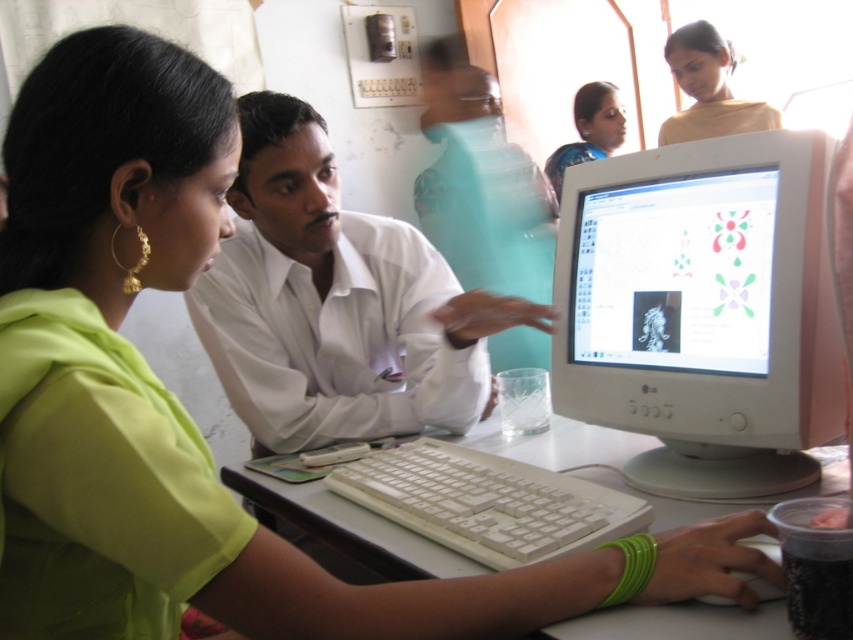
Question: Which point is closer to the camera?

Choices:
 (A) (840, 481)
 (B) (624, 128)
 (C) (260, 280)
 (D) (676, 38)

Answer: (A)

Question: From the image, what is the correct spatial relationship of white smooth shirt at center in relation to white plastic keyboard at lower center?

Choices:
 (A) right
 (B) left

Answer: (B)

Question: Among these points, which one is nearest to the camera?

Choices:
 (A) (592, 83)
 (B) (369, 348)
 (C) (726, 467)

Answer: (C)

Question: Is white plastic monitor at center thinner than white smooth shirt at center?

Choices:
 (A) no
 (B) yes

Answer: (B)

Question: Which of the following is the closest to the observer?

Choices:
 (A) (714, 426)
 (B) (434, 502)
 (C) (347, 550)

Answer: (B)

Question: Does matte yellow blouse at upper right appear under matte green saree at upper center?

Choices:
 (A) no
 (B) yes

Answer: (A)